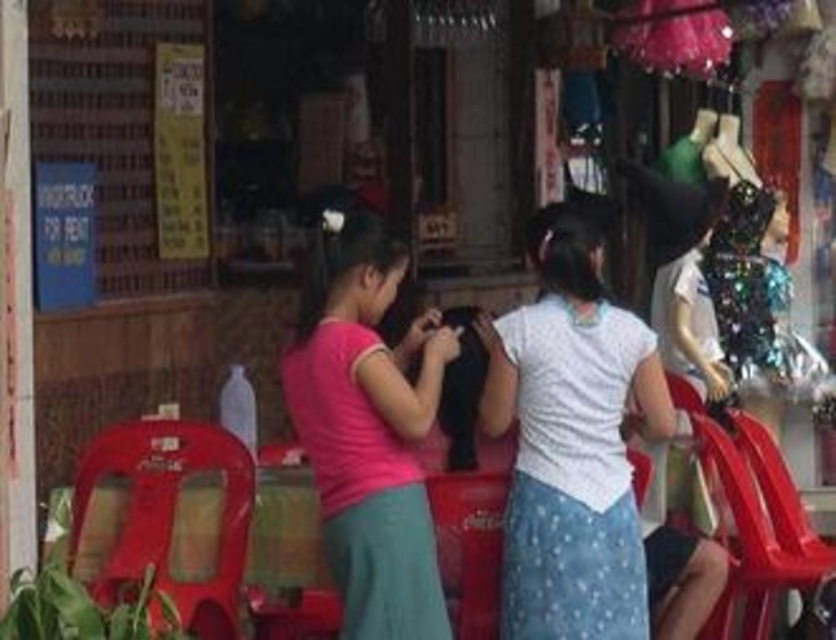
You are a delivery person who needs to place a small package on the matte plastic chair at lower left. However, there is a sparkly sequined dress at right on top of it. Can you place the package there without disturbing the dress?

The matte plastic chair at lower left is not as tall as the sparkly sequined dress at right, so the dress is taller than the chair. This means the dress might be resting on top of the chair, making it difficult to place the package without moving the dress.

You are a delivery person trying to place a small package on the metallic red chair at lower right without it falling off. Considering the sparkly sequined dress at right is nearby, which object should you place the package on to ensure stability?

The metallic red chair at lower right is taller than the sparkly sequined dress at right, so placing the package on the metallic red chair at lower right would provide a more stable and elevated surface to prevent it from falling off.

You are a photographer trying to capture a photo of the two girls in the scene. You want to ensure that both the pink matte shirt at center and the sparkly sequined dress at right are visible in the frame. Based on their positions, which girl should you focus on first to include both in the shot?

The pink matte shirt at center is positioned on the left side of the sparkly sequined dress at right. To include both in the frame, you should focus on the girl wearing the sparkly sequined dress at right first, as she is positioned further to the right and the pink matte shirt at center is to her left. This way, adjusting the camera to include both from left to right would be more effective.